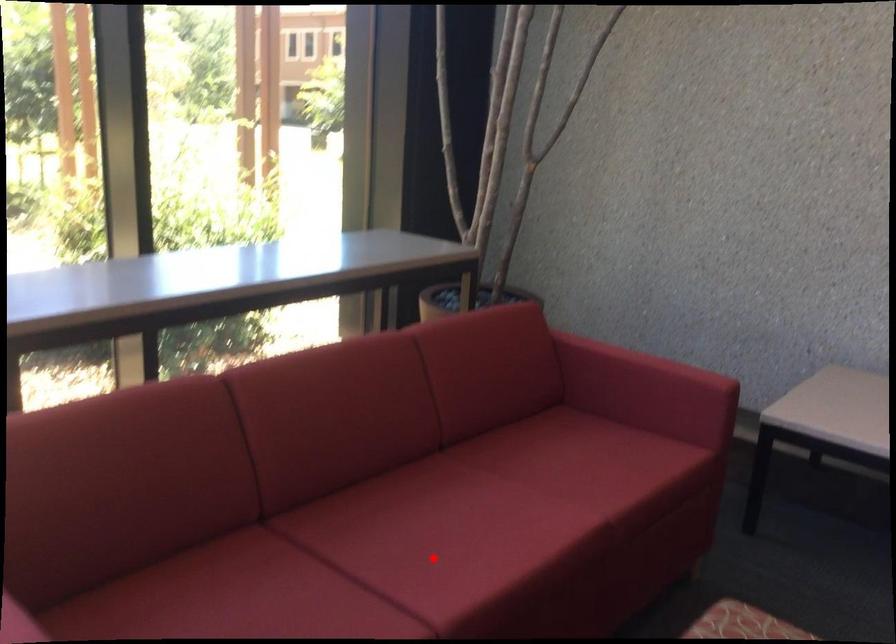
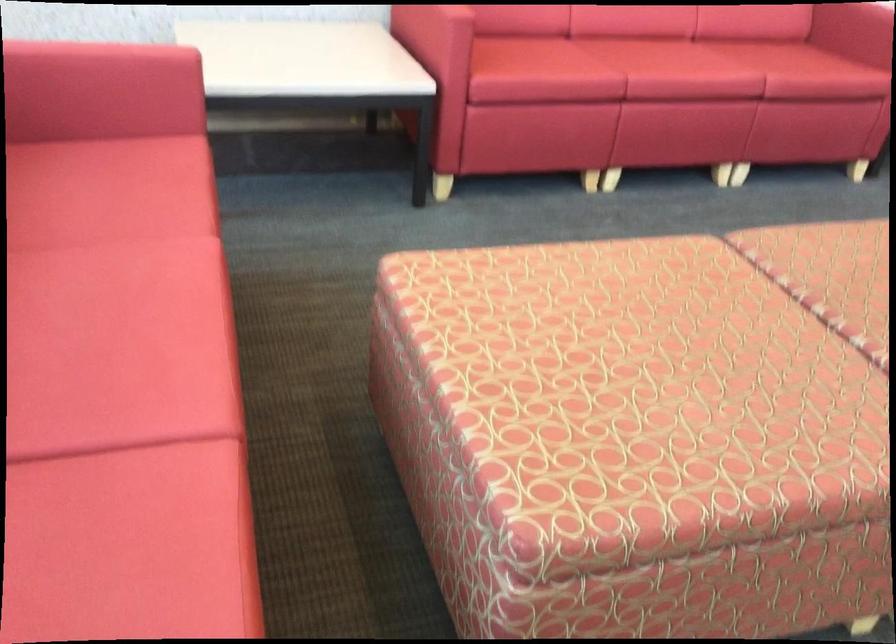
Where in the second image is the point corresponding to the highlighted location from the first image?

(117, 381)